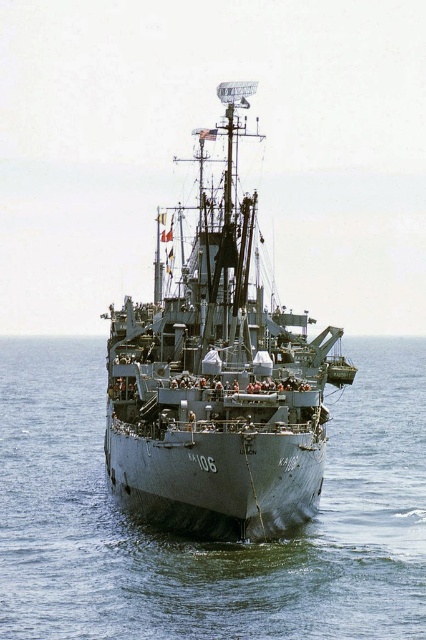
Looking at this image, you are a sailor on the gray metallic ship at center. You notice the gray matte water at center. Which object appears taller from your viewpoint?

The gray metallic ship at center appears taller than the gray matte water at center because the gray matte water at center is shorter than the gray metallic ship at center.

From the picture: You are a sailor on the gray metallic ship at center. You need to determine if the gray matte water at center can accommodate a larger vessel than your current ship. Based on the scene, what do you observe?

The gray matte water at center is larger in size than the gray metallic ship at center, so it can accommodate a larger vessel than your current ship.

You are standing on the deck of the naval ship KA 106 and see two points marked on the radar screen. The first point is at coordinate point (63, 634) and the second is at point (193, 317). Which point is closer to you?

Point (63, 634) is closer to the viewer than point (193, 317).